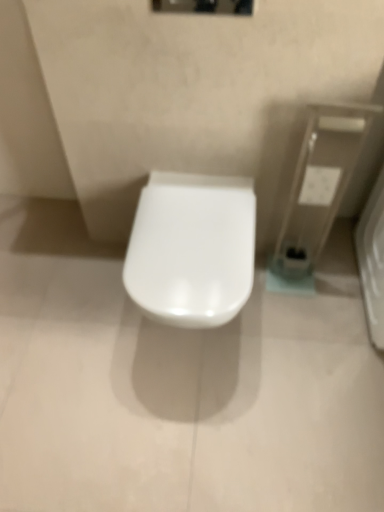
Find the location of a particular element. Image resolution: width=384 pixels, height=512 pixels. free space above white glossy toilet at center (from a real-world perspective) is located at coordinates (194, 232).